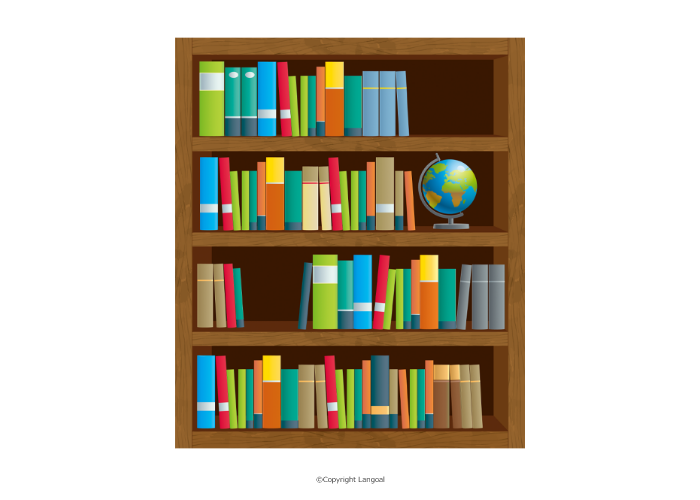
Find the location of a particular element. shelves with books on them is located at coordinates (330, 434), (332, 338), (330, 238), (335, 139).